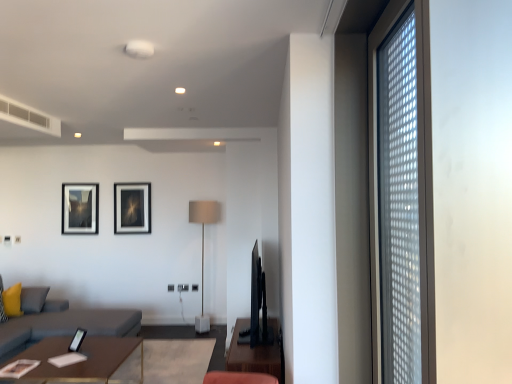
Question: Is gray fabric couch at left placed right next to wooden table at lower left, the 1th table when ordered from left to right?

Choices:
 (A) yes
 (B) no

Answer: (B)

Question: Considering the relative positions of gray fabric couch at left and wooden table at lower left, the 1th table when ordered from left to right, in the image provided, is gray fabric couch at left behind wooden table at lower left, the 1th table when ordered from left to right,?

Choices:
 (A) yes
 (B) no

Answer: (A)

Question: Is wooden table at lower left, acting as the second table starting from the right, a part of gray fabric couch at left?

Choices:
 (A) yes
 (B) no

Answer: (B)

Question: Is gray fabric couch at left closer to the viewer compared to wooden table at lower left, acting as the second table starting from the right?

Choices:
 (A) yes
 (B) no

Answer: (B)

Question: From the image's perspective, would you say gray fabric couch at left is positioned over wooden table at lower left, the 1th table when ordered from left to right?

Choices:
 (A) yes
 (B) no

Answer: (A)

Question: From the image's perspective, is yellow fabric pillow at lower left positioned above or below matte black picture frame at upper left, acting as the second picture frame starting from the top?

Choices:
 (A) above
 (B) below

Answer: (B)

Question: Considering the positions of yellow fabric pillow at lower left and matte black picture frame at upper left, the first picture frame when ordered from back to front, in the image, is yellow fabric pillow at lower left bigger or smaller than matte black picture frame at upper left, the first picture frame when ordered from back to front,?

Choices:
 (A) small
 (B) big

Answer: (A)

Question: Considering the positions of point (11, 297) and point (97, 190), is point (11, 297) closer or farther from the camera than point (97, 190)?

Choices:
 (A) farther
 (B) closer

Answer: (B)

Question: Relative to matte black picture frame at upper left, acting as the second picture frame starting from the top, is yellow fabric pillow at lower left in front or behind?

Choices:
 (A) behind
 (B) front

Answer: (B)

Question: From a real-world perspective, is matte black picture frame at lower center, the 1th picture frame from the front, physically located above or below brown wooden table at center, positioned as the 2th table in left-to-right order?

Choices:
 (A) below
 (B) above

Answer: (B)

Question: Is point (75, 334) closer or farther from the camera than point (274, 354)?

Choices:
 (A) closer
 (B) farther

Answer: (B)

Question: From the image's perspective, relative to brown wooden table at center, positioned as the 2th table in left-to-right order, is matte black picture frame at lower center, the 3th picture frame from the left, above or below?

Choices:
 (A) below
 (B) above

Answer: (B)

Question: Do you think matte black picture frame at lower center, which ranks as the third picture frame in back-to-front order, is within brown wooden table at center, marked as the first table in a right-to-left arrangement, or outside of it?

Choices:
 (A) outside
 (B) inside

Answer: (A)

Question: Is matte black picture frame at upper left, which is counted as the 1th picture frame, starting from the left, spatially inside wooden table at lower left, the 1th table when ordered from left to right, or outside of it?

Choices:
 (A) outside
 (B) inside

Answer: (A)

Question: Is matte black picture frame at upper left, the third picture frame viewed from the right, to the left or to the right of wooden table at lower left, the 1th table when ordered from left to right, in the image?

Choices:
 (A) right
 (B) left

Answer: (B)